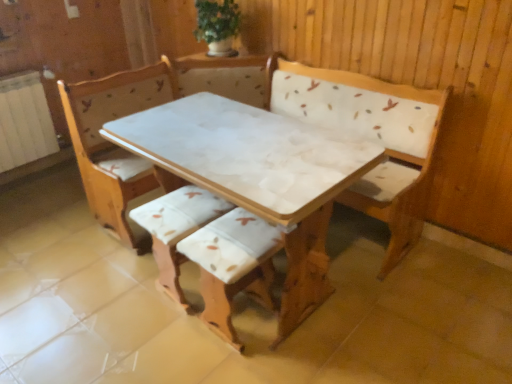
The height and width of the screenshot is (384, 512). I want to click on empty space that is ontop of white fabric cushion at center, which is the first armchair in left-to-right order (from a real-world perspective), so click(x=170, y=216).